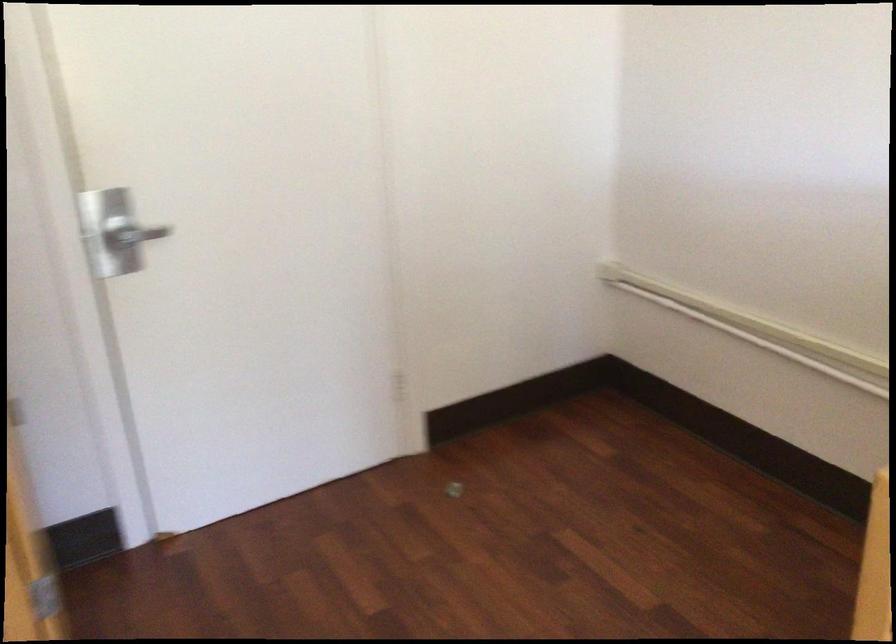
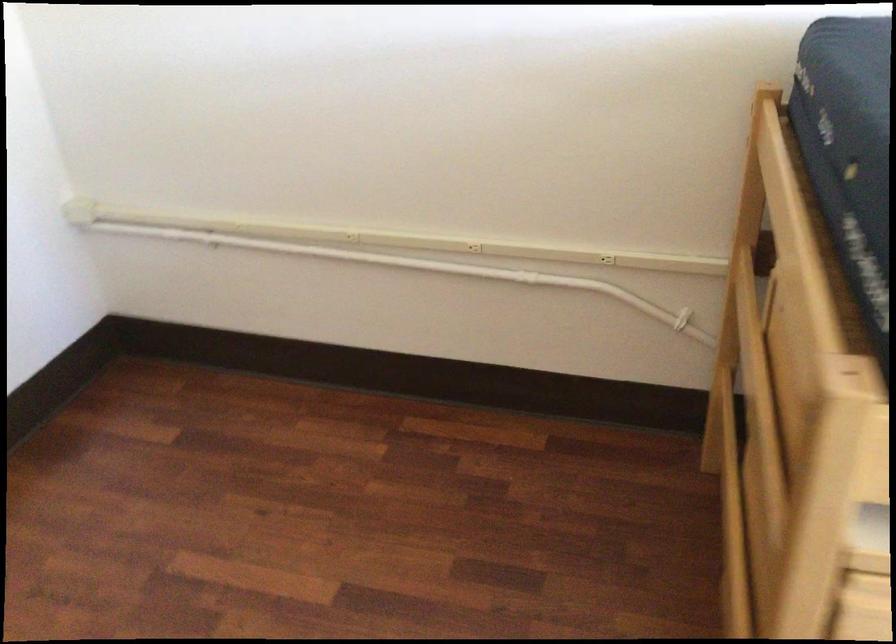
Question: The first image is from the beginning of the video and the second image is from the end. How did the camera likely rotate when shooting the video?

Choices:
 (A) Left
 (B) Right
 (C) Up
 (D) Down

Answer: (B)